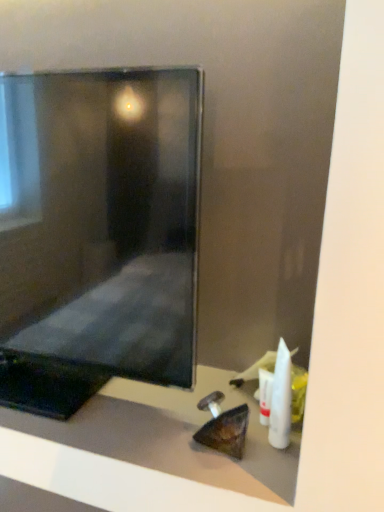
The image size is (384, 512). I want to click on unoccupied region to the right of matte black monitor at center, so click(x=204, y=419).